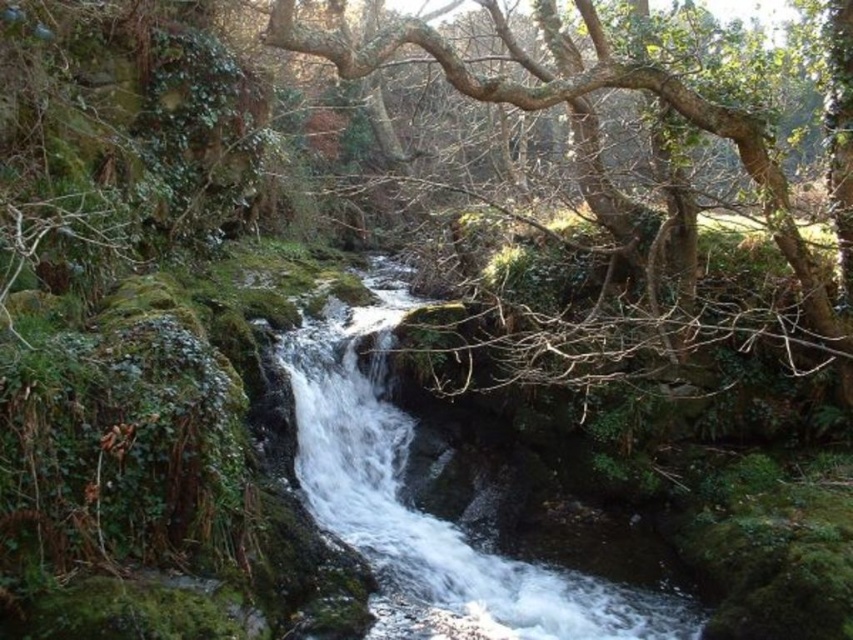
Question: Which point is closer to the camera?

Choices:
 (A) (398, 552)
 (B) (807, 289)

Answer: (A)

Question: Is white frothy water at center to the right of green leafy tree at center from the viewer's perspective?

Choices:
 (A) no
 (B) yes

Answer: (A)

Question: Which point is closer to the camera?

Choices:
 (A) (666, 76)
 (B) (468, 573)

Answer: (A)

Question: Is white frothy water at center to the left of green leafy tree at center from the viewer's perspective?

Choices:
 (A) yes
 (B) no

Answer: (A)

Question: Can you confirm if white frothy water at center is wider than green leafy tree at center?

Choices:
 (A) yes
 (B) no

Answer: (A)

Question: Which point is closer to the camera?

Choices:
 (A) (814, 298)
 (B) (657, 605)

Answer: (B)